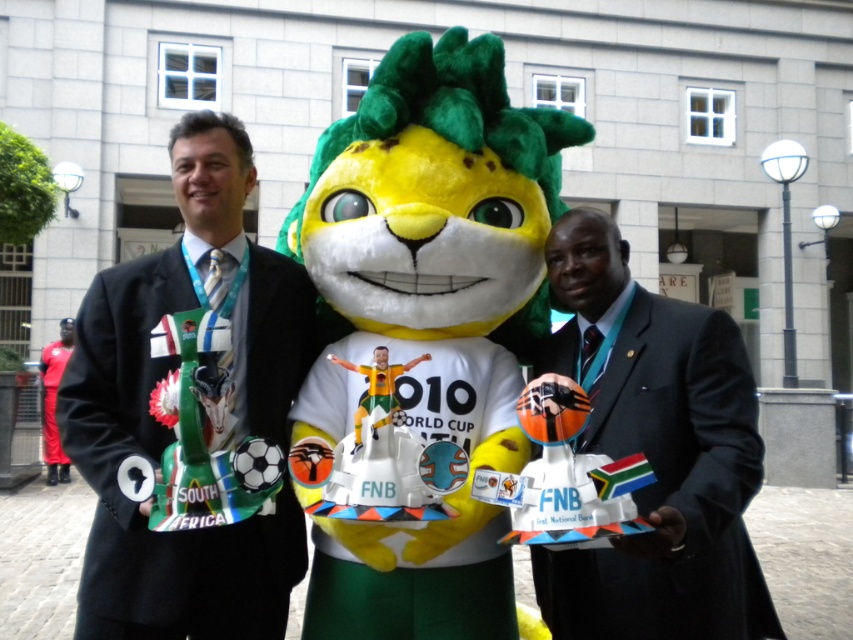
Who is shorter, matte black suit at center or dark gray suit at center?

dark gray suit at center is shorter.

Describe the element at coordinates (199, 408) in the screenshot. This screenshot has width=853, height=640. I see `matte black suit at center` at that location.

You are a GUI agent. You are given a task and a screenshot of the screen. Output one action in this format:
    pyautogui.click(x=<x>, y=<y>)
    Task: Click on the matte black suit at center
    
    Given the screenshot: What is the action you would take?
    pyautogui.click(x=199, y=408)

In the scene shown: Is soft plush lion at center wider than dark gray suit at center?

Yes.

Is point (424, 620) positioned after point (737, 544)?

Yes, point (424, 620) is behind point (737, 544).

Locate an element on the screen. The height and width of the screenshot is (640, 853). soft plush lion at center is located at coordinates (439, 234).

Which is in front, point (355, 115) or point (297, 312)?

Point (297, 312) is more forward.

I want to click on soft plush lion at center, so click(x=439, y=234).

I want to click on soft plush lion at center, so click(439, 234).